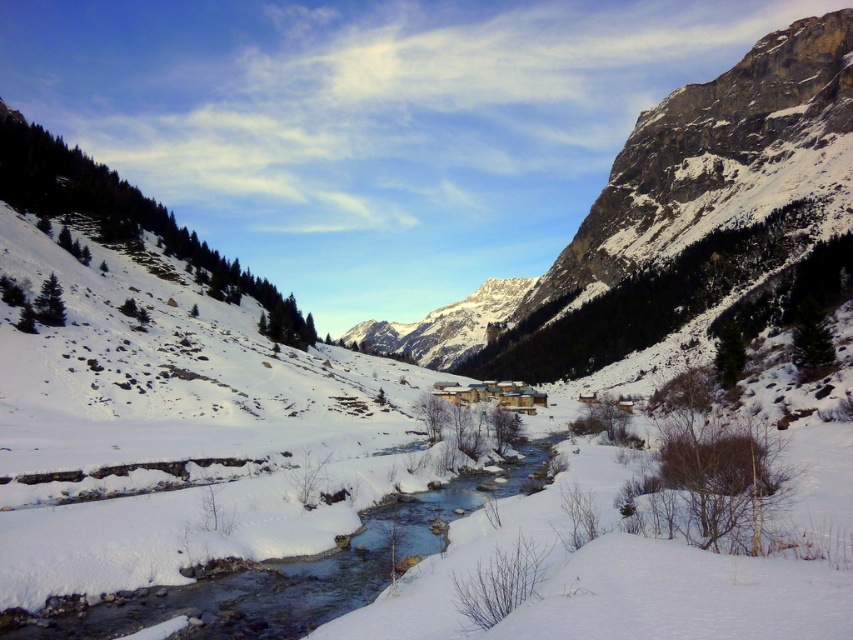
You are standing at the origin point of the image. Which direction should you move to reach the clear ice water at center?

The clear ice water at center is located at point 0.897 on the x axis and 0.334 on the y axis. Since you are at the origin point, you should move towards the right and slightly upwards to reach the clear ice water at center.

From the picture: You are standing at the edge of the valley and want to cross the river. The clear ice water at center and the snowy granite mountain at center are in your line of sight. Which object is closer to you?

The clear ice water at center is closer to the viewer than the snowy granite mountain at center, so the clear ice water at center is closer to you.

You are a hiker planning to cross the clear ice water at center and reach the snowy granite mountain at center. Based on the scene, which object is closer to you? Please explain your reasoning.

The clear ice water at center is closer to you than the snowy granite mountain at center because it appears shorter in the image, which typically indicates proximity in such landscapes.